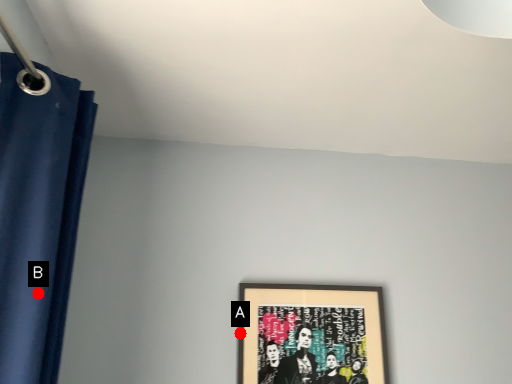
Question: Two points are circled on the image, labeled by A and B beside each circle. Among these points, which one is farthest from the camera?

Choices:
 (A) A is further
 (B) B is further

Answer: (A)